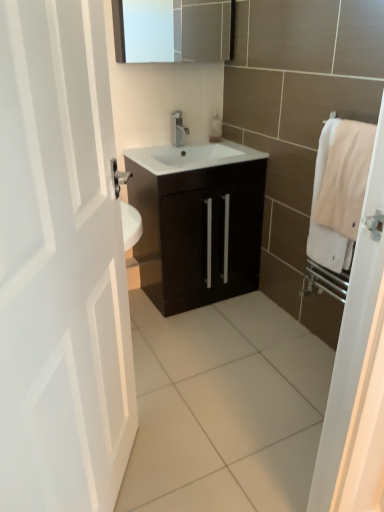
Question: Is translucent plastic soap dispenser at center not within white matte door at left?

Choices:
 (A) no
 (B) yes

Answer: (B)

Question: Is translucent plastic soap dispenser at center aimed at white matte door at left?

Choices:
 (A) yes
 (B) no

Answer: (B)

Question: Can you confirm if translucent plastic soap dispenser at center is positioned to the left of white matte door at left?

Choices:
 (A) yes
 (B) no

Answer: (B)

Question: Is translucent plastic soap dispenser at center directly adjacent to white matte door at left?

Choices:
 (A) no
 (B) yes

Answer: (A)

Question: Can you confirm if translucent plastic soap dispenser at center is smaller than white matte door at left?

Choices:
 (A) yes
 (B) no

Answer: (A)

Question: From their relative heights in the image, would you say white cotton bath towel at right is taller or shorter than satin nickel faucet at center?

Choices:
 (A) tall
 (B) short

Answer: (A)

Question: From the image's perspective, is white cotton bath towel at right positioned above or below satin nickel faucet at center?

Choices:
 (A) above
 (B) below

Answer: (B)

Question: From a real-world perspective, is white cotton bath towel at right above or below satin nickel faucet at center?

Choices:
 (A) above
 (B) below

Answer: (B)

Question: Is point (329, 210) closer or farther from the camera than point (175, 123)?

Choices:
 (A) farther
 (B) closer

Answer: (B)

Question: In the image, is white cotton bath towel at right on the left side or the right side of translucent plastic soap dispenser at center?

Choices:
 (A) left
 (B) right

Answer: (B)

Question: Considering the positions of point (347, 233) and point (215, 116), is point (347, 233) closer or farther from the camera than point (215, 116)?

Choices:
 (A) closer
 (B) farther

Answer: (A)

Question: From a real-world perspective, is white cotton bath towel at right above or below translucent plastic soap dispenser at center?

Choices:
 (A) below
 (B) above

Answer: (A)

Question: Looking at their shapes, would you say white cotton bath towel at right is wider or thinner than translucent plastic soap dispenser at center?

Choices:
 (A) wide
 (B) thin

Answer: (B)

Question: Considering their positions, is dark wood cabinet at center located in front of or behind white matte door at left?

Choices:
 (A) front
 (B) behind

Answer: (B)

Question: In the image, is dark wood cabinet at center on the left side or the right side of white matte door at left?

Choices:
 (A) left
 (B) right

Answer: (B)